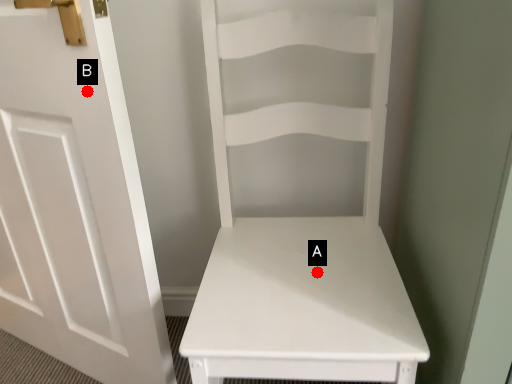
Question: Two points are circled on the image, labeled by A and B beside each circle. Which point is farther from the camera taking this photo?

Choices:
 (A) A is further
 (B) B is further

Answer: (A)